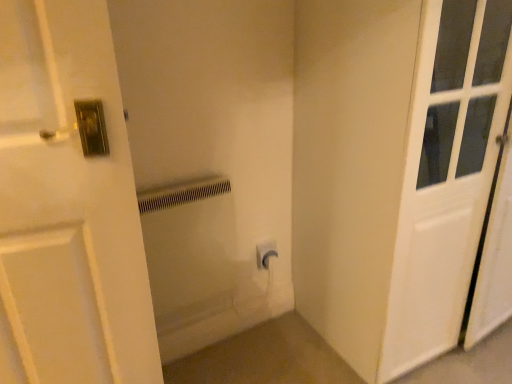
Image resolution: width=512 pixels, height=384 pixels. What do you see at coordinates (265, 253) in the screenshot? I see `white plastic electric outlet at center` at bounding box center [265, 253].

I want to click on white plastic electric outlet at center, so click(265, 253).

What do you see at coordinates (205, 266) in the screenshot? This screenshot has height=384, width=512. I see `white plastic radiator at center` at bounding box center [205, 266].

Where is `white plastic electric outlet at center`? The height and width of the screenshot is (384, 512). white plastic electric outlet at center is located at coordinates (265, 253).

From the image's perspective, would you say white plastic radiator at center is shown under white matte door at right?

Yes, from the image's perspective, white plastic radiator at center is below white matte door at right.

Which object is positioned more to the left, white plastic radiator at center or white matte door at right?

white plastic radiator at center.

Which is nearer, (168, 355) or (450, 79)?

Clearly, point (168, 355) is closer to the camera than point (450, 79).

From a real-world perspective, relative to white matte door at right, is white plastic electric outlet at center vertically above or below?

white plastic electric outlet at center is situated lower than white matte door at right in the real world.

How far apart are white plastic electric outlet at center and white matte door at right?

29.64 inches.

Is white plastic electric outlet at center next to white matte door at right and touching it?

No.

Which is correct: white plastic electric outlet at center is inside white matte door at right, or outside of it?

white plastic electric outlet at center is located beyond the bounds of white matte door at right.

From a real-world perspective, is white plastic electric outlet at center located beneath white plastic radiator at center?

Yes.

Identify the location of bath below the white plastic electric outlet at center (from the image's perspective). This screenshot has width=512, height=384. (205, 266).

Does white plastic electric outlet at center touch white plastic radiator at center?

white plastic electric outlet at center is not next to white plastic radiator at center, and they're not touching.

From the image's perspective, is white plastic electric outlet at center above or below white plastic radiator at center?

Based on their image positions, white plastic electric outlet at center is located above white plastic radiator at center.

How far apart are white plastic radiator at center and white plastic electric outlet at center?

The distance of white plastic radiator at center from white plastic electric outlet at center is 10.32 inches.

Based on the photo, is white plastic radiator at center touching white plastic electric outlet at center?

No, white plastic radiator at center is not making contact with white plastic electric outlet at center.

Is white plastic radiator at center bigger or smaller than white plastic electric outlet at center?

Considering their sizes, white plastic radiator at center takes up more space than white plastic electric outlet at center.

Could you tell me if white plastic radiator at center is facing white plastic electric outlet at center?

No, white plastic radiator at center is not facing towards white plastic electric outlet at center.

From the image's perspective, between white matte door at right and white plastic radiator at center, who is located below?

white plastic radiator at center, from the image's perspective.

Choose the correct answer: Is white matte door at right inside white plastic radiator at center or outside it?

white matte door at right is spatially situated outside white plastic radiator at center.

In terms of height, does white matte door at right look taller or shorter compared to white plastic radiator at center?

Considering their sizes, white matte door at right has more height than white plastic radiator at center.

Considering the sizes of objects white matte door at right and white plastic radiator at center in the image provided, who is smaller, white matte door at right or white plastic radiator at center?

white plastic radiator at center is smaller.

Is point (443, 263) positioned behind point (267, 267)?

That is False.

Considering the sizes of objects white matte door at right and white plastic electric outlet at center in the image provided, who is taller, white matte door at right or white plastic electric outlet at center?

Standing taller between the two is white matte door at right.

Is white matte door at right positioned in front of white plastic electric outlet at center?

Yes, white matte door at right is closer to the camera.

From the image's perspective, which one is positioned lower, white matte door at right or white plastic electric outlet at center?

white plastic electric outlet at center appears lower in the image.

In the image, there is a white matte door at right. Where is `bath below it (from the image's perspective)`? The height and width of the screenshot is (384, 512). bath below it (from the image's perspective) is located at coordinates (205, 266).

Image resolution: width=512 pixels, height=384 pixels. Identify the location of door in front of the white plastic electric outlet at center. (446, 174).

From the image, which object appears to be farther from white plastic electric outlet at center, white plastic radiator at center or white matte door at right?

The object further to white plastic electric outlet at center is white matte door at right.

Considering their positions, is white plastic electric outlet at center positioned closer to white plastic radiator at center than white matte door at right?

Based on the image, white plastic electric outlet at center appears to be nearer to white plastic radiator at center.

When comparing their distances from white plastic electric outlet at center, does white matte door at right or white plastic radiator at center seem further?

The object further to white plastic electric outlet at center is white matte door at right.

Based on their spatial positions, is white plastic electric outlet at center or white plastic radiator at center further from white matte door at right?

white plastic electric outlet at center is positioned further to the anchor white matte door at right.

Based on the photo, looking at the image, which one is located further to white plastic radiator at center, white matte door at right or white plastic electric outlet at center?

Based on the image, white matte door at right appears to be further to white plastic radiator at center.

Considering their positions, is white plastic radiator at center positioned closer to white matte door at right than white plastic electric outlet at center?

Answer: The object closer to white matte door at right is white plastic radiator at center.

Image resolution: width=512 pixels, height=384 pixels. What are the coordinates of `electric outlet between white plastic radiator at center and white matte door at right from left to right` in the screenshot? It's located at (265, 253).